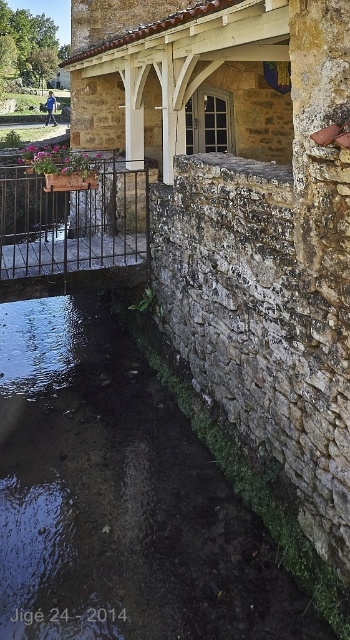
Looking at this image, is dark stone river at lower left to the right of metallic black railing at center from the viewer's perspective?

Yes, dark stone river at lower left is to the right of metallic black railing at center.

Does point (217, 445) come farther from viewer compared to point (35, 225)?

That is False.

What are the coordinates of `dark stone river at lower left` in the screenshot? It's located at (124, 497).